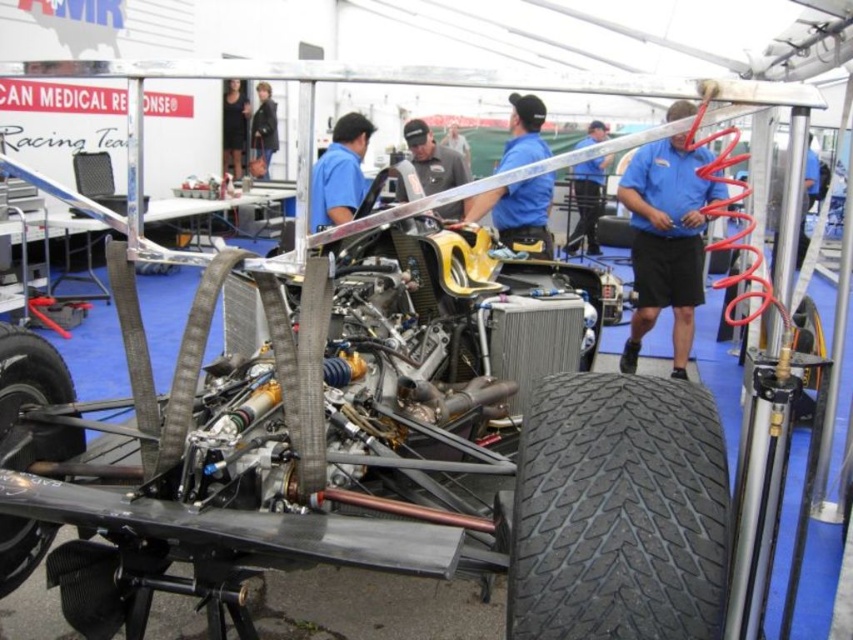
Does blue shirt at center have a greater width compared to black dress at upper center?

Yes, blue shirt at center is wider than black dress at upper center.

Does blue shirt at center have a lesser width compared to black dress at upper center?

Incorrect, blue shirt at center's width is not less than black dress at upper center's.

Is point (593, 179) less distant than point (223, 138)?

No.

This screenshot has height=640, width=853. Find the location of `blue shirt at center`. blue shirt at center is located at coordinates click(x=585, y=202).

Does black rubber tire at lower right appear over matte black shirt at center?

No, black rubber tire at lower right is not above matte black shirt at center.

Is point (622, 568) positioned after point (431, 186)?

No.

Locate an element on the screen. This screenshot has width=853, height=640. black rubber tire at lower right is located at coordinates (618, 512).

In the scene shown: Can you confirm if blue fabric shirt at center is taller than blue shirt at center?

Indeed, blue fabric shirt at center has a greater height compared to blue shirt at center.

Describe the element at coordinates (666, 241) in the screenshot. Image resolution: width=853 pixels, height=640 pixels. I see `blue fabric shirt at center` at that location.

Which is in front, point (688, 333) or point (596, 216)?

Positioned in front is point (688, 333).

Locate an element on the screen. This screenshot has height=640, width=853. blue fabric shirt at center is located at coordinates (666, 241).